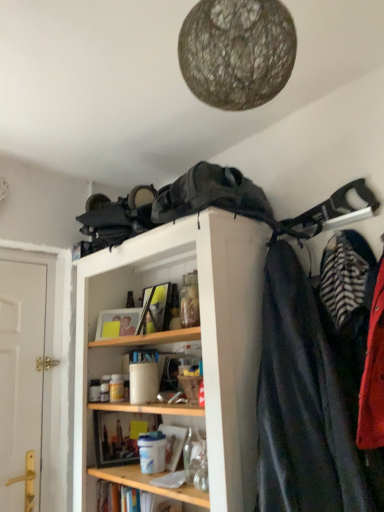
What is the approximate height of wooden shelf at lower center?

wooden shelf at lower center is 18.92 centimeters in height.

The height and width of the screenshot is (512, 384). Find the location of `wooden shelf at lower center`. wooden shelf at lower center is located at coordinates (150, 484).

Measure the distance between point (234, 208) and camera.

Point (234, 208) is 1.41 meters from camera.

This screenshot has height=512, width=384. Find the location of `striped fabric coat at right, arranged as the 1th cloak when ordered from the bottom`. striped fabric coat at right, arranged as the 1th cloak when ordered from the bottom is located at coordinates (311, 398).

Between wooden shelf at upper center and dark gray fabric backpack at upper center, placed as the 1th cloak when sorted from left to right, which one has smaller size?

Smaller between the two is dark gray fabric backpack at upper center, placed as the 1th cloak when sorted from left to right.

Is there a large distance between wooden shelf at upper center and dark gray fabric backpack at upper center, the 2th cloak from the right?

They are positioned close to each other.

Is wooden shelf at upper center behind dark gray fabric backpack at upper center, the 2th cloak from the right?

No, the depth of wooden shelf at upper center is less than that of dark gray fabric backpack at upper center, the 2th cloak from the right.

Locate an element on the screen. The width and height of the screenshot is (384, 512). cloak that is the 1st one when counting rightward from the wooden shelf at upper center is located at coordinates (211, 195).

From the image's perspective, is white wooden door at left above or below striped fabric coat at right, placed as the second cloak when sorted from left to right?

Based on their image positions, white wooden door at left is located beneath striped fabric coat at right, placed as the second cloak when sorted from left to right.

Which is behind, white wooden door at left or striped fabric coat at right, the first cloak in the right-to-left sequence?

Positioned behind is white wooden door at left.

Where is `the 2nd cloak in front when counting from the white wooden door at left`? The height and width of the screenshot is (512, 384). the 2nd cloak in front when counting from the white wooden door at left is located at coordinates [x=311, y=398].

In the image, is white wooden door at left positioned in front of or behind wooden shelf at lower center?

Clearly, white wooden door at left is behind wooden shelf at lower center.

Does white wooden door at left have a smaller size compared to wooden shelf at lower center?

No.

Is white wooden door at left far from wooden shelf at lower center?

No, white wooden door at left is not far from wooden shelf at lower center.

Would you say wooden shelf at lower center is part of white wooden door at left's contents?

No, white wooden door at left does not contain wooden shelf at lower center.

Is striped fabric coat at right, placed as the second cloak when sorted from left to right, directly adjacent to wooden shelf at lower center?

striped fabric coat at right, placed as the second cloak when sorted from left to right, and wooden shelf at lower center are clearly separated.

Does striped fabric coat at right, the first cloak in the right-to-left sequence, have a greater height compared to wooden shelf at lower center?

Yes, striped fabric coat at right, the first cloak in the right-to-left sequence, is taller than wooden shelf at lower center.

Considering the points (293, 332) and (170, 493), which point is in front, point (293, 332) or point (170, 493)?

The point (293, 332) is closer.

From a real-world perspective, which is physically above, wooden shelf at lower center or striped fabric coat at right, the first cloak in the right-to-left sequence?

From a 3D spatial view, striped fabric coat at right, the first cloak in the right-to-left sequence, is above.

Considering the points (197, 496) and (359, 451), which point is in front, point (197, 496) or point (359, 451)?

The point (359, 451) is closer to the camera.

Is wooden shelf at lower center at the right side of striped fabric coat at right, arranged as the 1th cloak when ordered from the bottom?

Incorrect, wooden shelf at lower center is not on the right side of striped fabric coat at right, arranged as the 1th cloak when ordered from the bottom.

Would you say wooden shelf at lower center is a long distance from striped fabric coat at right, placed as the second cloak when sorted from left to right?

Actually, wooden shelf at lower center and striped fabric coat at right, placed as the second cloak when sorted from left to right, are a little close together.

From a real-world perspective, is wooden shelf at lower center located higher than wooden shelf at upper center?

No, from a real-world perspective, wooden shelf at lower center is not above wooden shelf at upper center.

Is wooden shelf at lower center further to the viewer compared to wooden shelf at upper center?

Yes.

Is wooden shelf at lower center completely or partially outside of wooden shelf at upper center?

No, most part of wooden shelf at lower center lies within wooden shelf at upper center.

Does striped fabric coat at right, the 2th cloak positioned from the top, appear on the right side of dark gray fabric backpack at upper center, the first cloak viewed from the top?

Yes.

Which object is further away from the camera, striped fabric coat at right, the 2th cloak positioned from the top, or dark gray fabric backpack at upper center, the first cloak viewed from the top?

dark gray fabric backpack at upper center, the first cloak viewed from the top.

Would you say striped fabric coat at right, arranged as the 1th cloak when ordered from the bottom, is inside or outside dark gray fabric backpack at upper center, placed as the 1th cloak when sorted from left to right?

striped fabric coat at right, arranged as the 1th cloak when ordered from the bottom, is outside dark gray fabric backpack at upper center, placed as the 1th cloak when sorted from left to right.

This screenshot has height=512, width=384. Find the location of `the 2nd cloak behind the wooden shelf at upper center, starting your count from the anchor`. the 2nd cloak behind the wooden shelf at upper center, starting your count from the anchor is located at coordinates (211, 195).

The width and height of the screenshot is (384, 512). I want to click on door below the striped fabric coat at right, the 2th cloak positioned from the top (from a real-world perspective), so click(x=21, y=383).

From the image, which object appears to be nearer to wooden shelf at upper center, dark gray fabric backpack at upper center, the 2th cloak from the right, or striped fabric coat at right, the 2th cloak positioned from the top?

dark gray fabric backpack at upper center, the 2th cloak from the right, is closer to wooden shelf at upper center.

Based on their spatial positions, is dark gray fabric backpack at upper center, the 2th cloak from the right, or white wooden door at left further from wooden shelf at upper center?

white wooden door at left is further to wooden shelf at upper center.

Which object lies nearer to the anchor point wooden shelf at upper center, wooden shelf at lower center or white wooden door at left?

wooden shelf at lower center is closer to wooden shelf at upper center.

Based on their spatial positions, is wooden shelf at lower center or dark gray fabric backpack at upper center, the 2th cloak from the right, further from wooden shelf at upper center?

The object further to wooden shelf at upper center is wooden shelf at lower center.

Consider the image. From the image, which object appears to be farther from white wooden door at left, wooden shelf at lower center or wooden shelf at upper center?

Based on the image, wooden shelf at lower center appears to be further to white wooden door at left.

When comparing their distances from dark gray fabric backpack at upper center, the 2th cloak from the right, does striped fabric coat at right, placed as the second cloak when sorted from left to right, or wooden shelf at lower center seem further?

wooden shelf at lower center.

When comparing their distances from wooden shelf at lower center, does wooden shelf at upper center or white wooden door at left seem closer?

wooden shelf at upper center.

When comparing their distances from wooden shelf at upper center, does white wooden door at left or striped fabric coat at right, the 2th cloak positioned from the top, seem further?

The object further to wooden shelf at upper center is white wooden door at left.

Locate an element on the screen. shelf situated between white wooden door at left and striped fabric coat at right, placed as the second cloak when sorted from left to right, from left to right is located at coordinates (187, 337).

Where is `cabinet situated between white wooden door at left and wooden shelf at upper center from left to right`? This screenshot has height=512, width=384. cabinet situated between white wooden door at left and wooden shelf at upper center from left to right is located at coordinates (150, 484).

Identify the location of cloak between dark gray fabric backpack at upper center, which is counted as the 2th cloak, starting from the bottom, and wooden shelf at lower center in the up-down direction. (311, 398).

Locate an element on the screen. cloak between dark gray fabric backpack at upper center, placed as the 1th cloak when sorted from left to right, and wooden shelf at upper center from top to bottom is located at coordinates [311, 398].